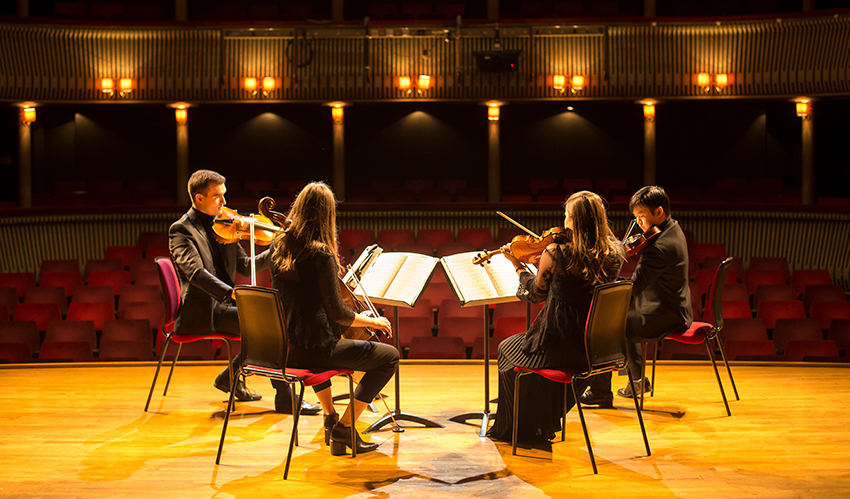
Image resolution: width=850 pixels, height=499 pixels. Identify the location of chair. (279, 347), (183, 332), (588, 369), (700, 326).